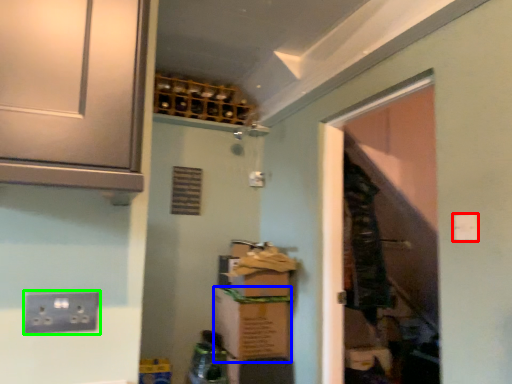
Question: Based on their relative distances, which object is nearer to light switch (highlighted by a red box)? Choose from cardboard box (highlighted by a blue box) and electric outlet (highlighted by a green box).

Choices:
 (A) cardboard box
 (B) electric outlet

Answer: (B)